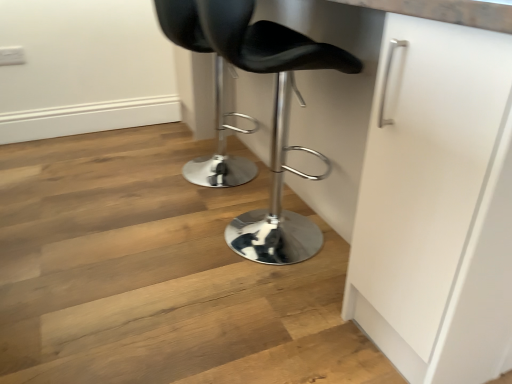
Locate an element on the screen. This screenshot has width=512, height=384. free space in front of black leather stool at center, the first chair in the front-to-back sequence is located at coordinates (252, 317).